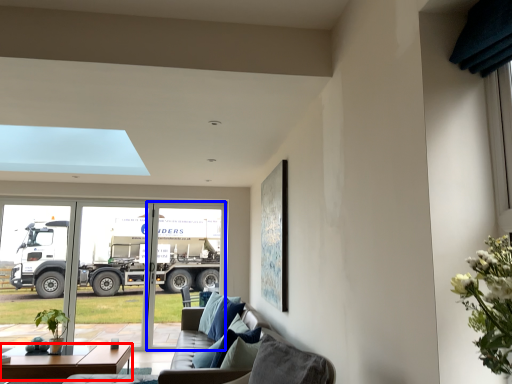
Question: Which object appears farthest to the camera in this image, table (highlighted by a red box) or screen door (highlighted by a blue box)?

Choices:
 (A) table
 (B) screen door

Answer: (B)